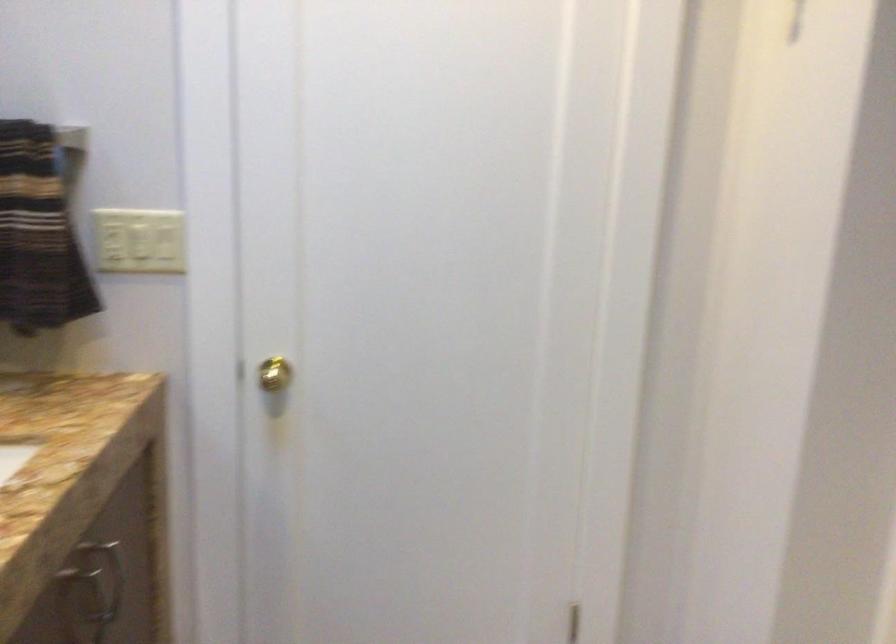
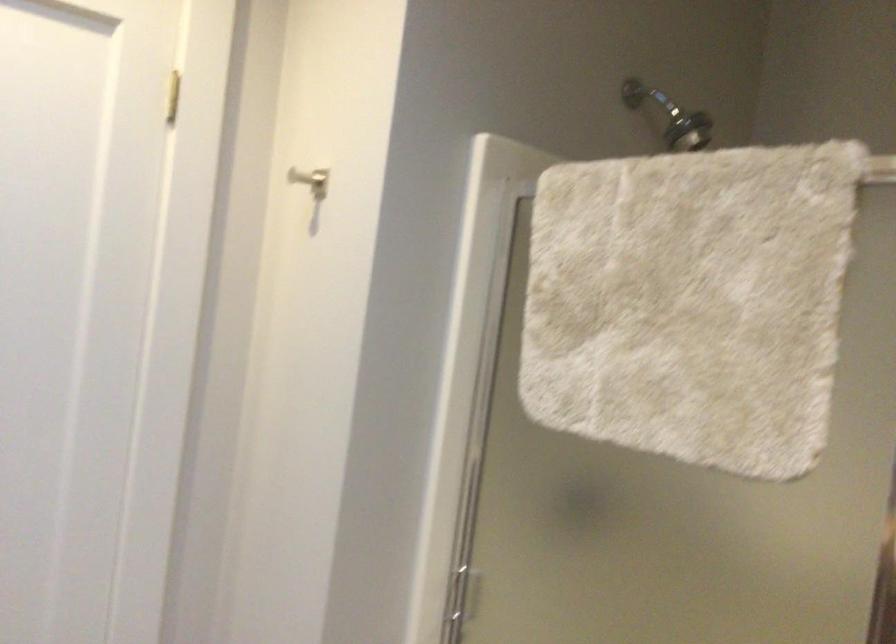
Question: The camera is either moving clockwise (left) or counter-clockwise (right) around the object. The first image is from the beginning of the video and the second image is from the end. Is the camera moving left or right when shooting the video?

Choices:
 (A) Left
 (B) Right

Answer: (A)